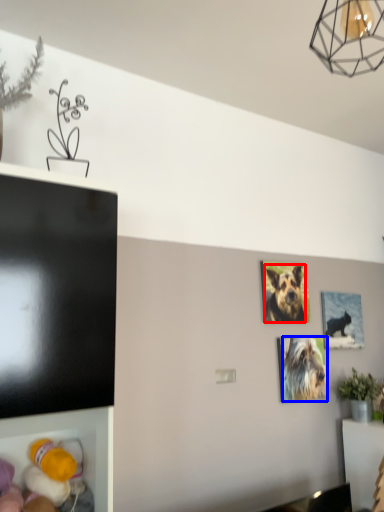
Question: Which object is further to the camera taking this photo, dog (highlighted by a red box) or dog (highlighted by a blue box)?

Choices:
 (A) dog
 (B) dog

Answer: (A)